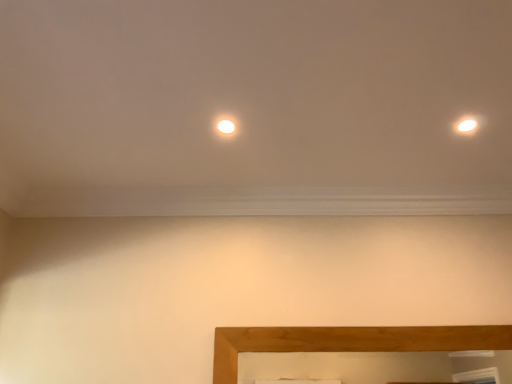
Question: From a real-world perspective, is matte white light at center above or below wooden picture frame at lower center?

Choices:
 (A) below
 (B) above

Answer: (B)

Question: From the image's perspective, is matte white light at center above or below wooden picture frame at lower center?

Choices:
 (A) below
 (B) above

Answer: (B)

Question: Which is nearer to the matte white light at center?

Choices:
 (A) white glossy light at upper right
 (B) wooden picture frame at lower center

Answer: (A)

Question: Which of these objects is positioned closest to the matte white light at center?

Choices:
 (A) wooden picture frame at lower center
 (B) white glossy light at upper right

Answer: (B)